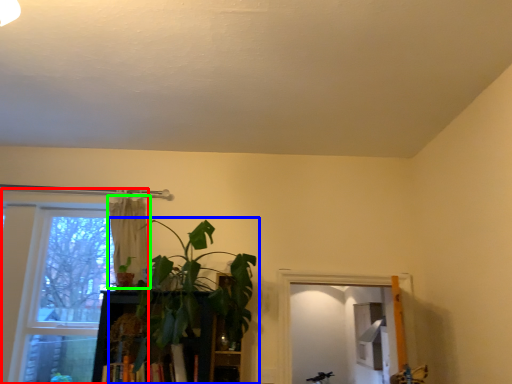
Question: Which object is the farthest from window (highlighted by a red box)? Choose among these: houseplant (highlighted by a blue box) or curtain (highlighted by a green box).

Choices:
 (A) houseplant
 (B) curtain

Answer: (A)